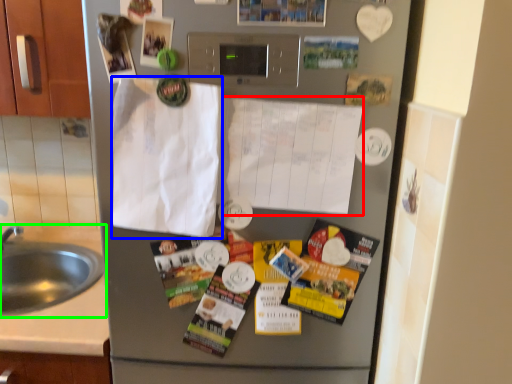
Question: Which object is the farthest from paper (highlighted by a red box)? Choose among these: envelope (highlighted by a blue box) or sink (highlighted by a green box).

Choices:
 (A) envelope
 (B) sink

Answer: (B)